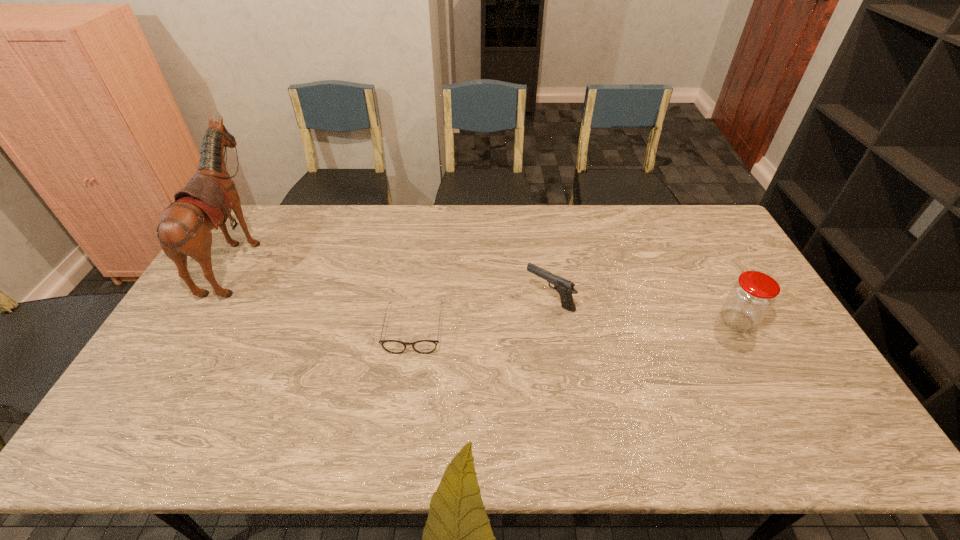
The height and width of the screenshot is (540, 960). I want to click on the tallest object, so click(184, 229).

At what (x,y) coordinates should I click in order to perform the action: click on saddle. Please return your answer as a coordinate pair (x, y). The height and width of the screenshot is (540, 960). Looking at the image, I should click on (184, 229).

The image size is (960, 540). In order to click on jar in this screenshot , I will do `click(751, 297)`.

At what (x,y) coordinates should I click in order to perform the action: click on the second tallest object. Please return your answer as a coordinate pair (x, y). The width and height of the screenshot is (960, 540). Looking at the image, I should click on tap(751, 297).

I want to click on the third tallest object, so click(x=565, y=288).

Image resolution: width=960 pixels, height=540 pixels. I want to click on the second object from right to left, so click(x=565, y=288).

Locate an element on the screen. This screenshot has height=540, width=960. the shortest object is located at coordinates (392, 346).

You are a GUI agent. You are given a task and a screenshot of the screen. Output one action in this format:
    pyautogui.click(x=<x>, y=<y>)
    Task: Click on the second object from left to right
    This screenshot has width=960, height=540.
    Given the screenshot: What is the action you would take?
    pyautogui.click(x=392, y=346)

The image size is (960, 540). Find the location of `vacant region located 0.070m on the back of the tallest object`. vacant region located 0.070m on the back of the tallest object is located at coordinates (279, 256).

At what (x,y) coordinates should I click in order to perform the action: click on vacant region located on the front of the rightmost object. Please return your answer as a coordinate pair (x, y). Looking at the image, I should click on (776, 392).